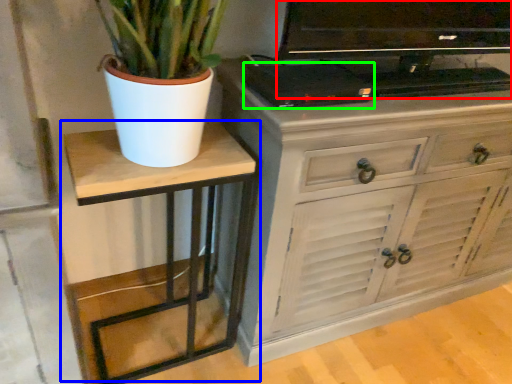
Question: Which object is positioned closest to television (highlighted by a red box)? Select from table (highlighted by a blue box) and appliance (highlighted by a green box).

Choices:
 (A) table
 (B) appliance

Answer: (B)